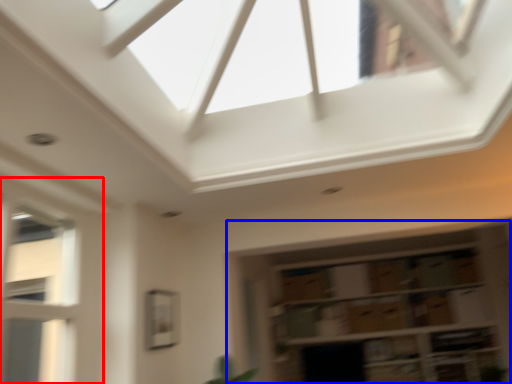
Question: Among these objects, which one is nearest to the camera, window (highlighted by a red box) or shelf (highlighted by a blue box)?

Choices:
 (A) window
 (B) shelf

Answer: (A)